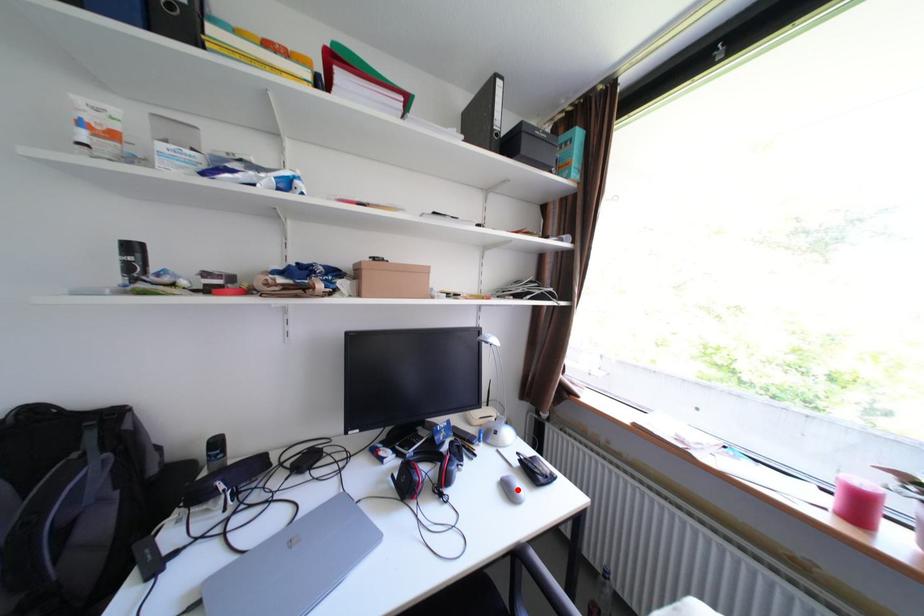
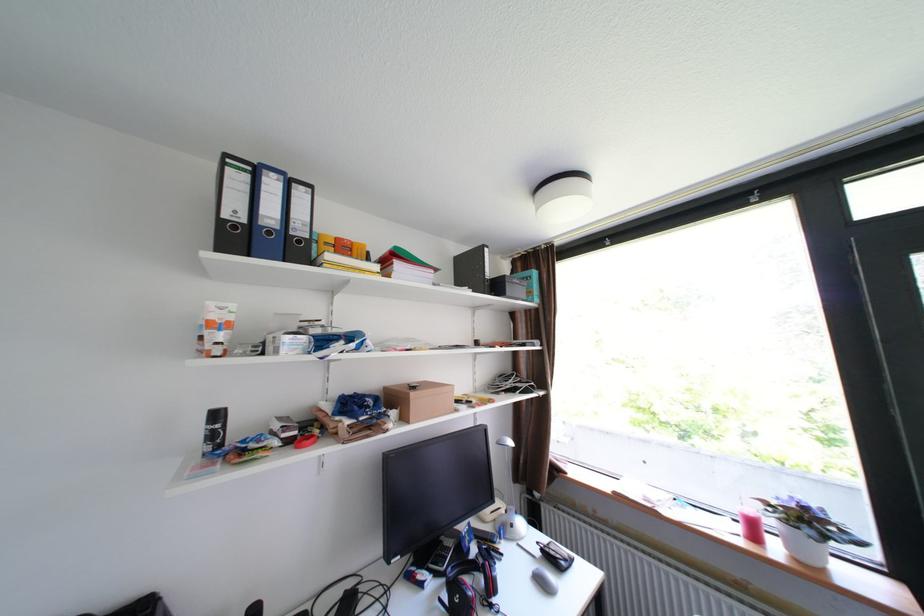
Locate, in the second image, the point that corresponds to the highlighted location in the first image.

(552, 583)